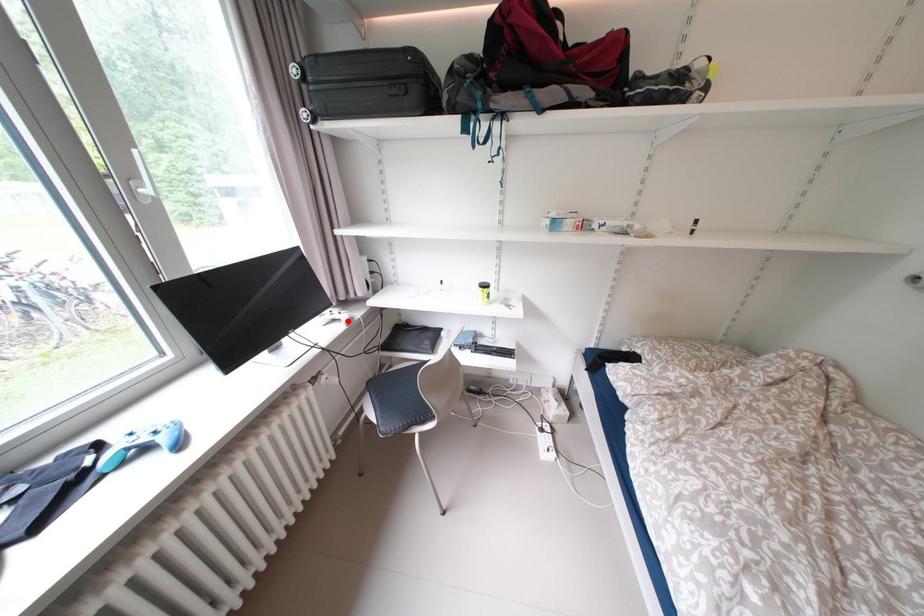
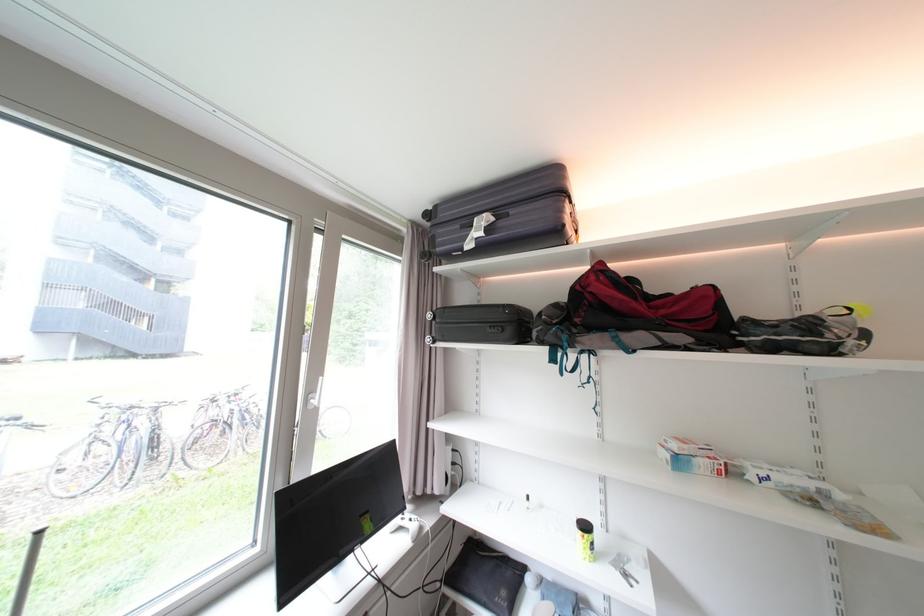
Locate, in the second image, the point that corresponds to the highlighted location in the first image.

(417, 530)